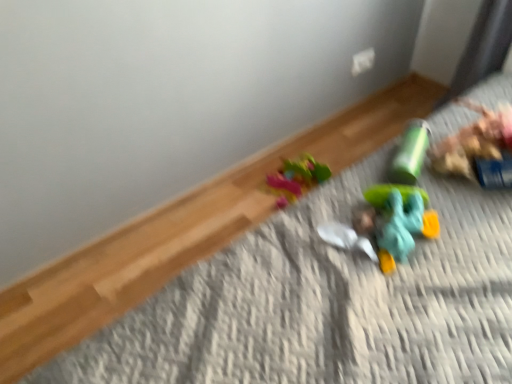
Question: Is smooth plastic head at center aimed at green matte cylinder at upper right, acting as the second toy starting from the front?

Choices:
 (A) no
 (B) yes

Answer: (A)

Question: Considering the relative sizes of smooth plastic head at center and green matte cylinder at upper right, marked as the 2th toy in a bottom-to-top arrangement, in the image provided, is smooth plastic head at center thinner than green matte cylinder at upper right, marked as the 2th toy in a bottom-to-top arrangement,?

Choices:
 (A) no
 (B) yes

Answer: (B)

Question: From the image's perspective, is smooth plastic head at center over green matte cylinder at upper right, positioned as the 1th toy in top-to-bottom order?

Choices:
 (A) no
 (B) yes

Answer: (A)

Question: Is smooth plastic head at center not within green matte cylinder at upper right, positioned as the 1th toy in top-to-bottom order?

Choices:
 (A) yes
 (B) no

Answer: (A)

Question: Is smooth plastic head at center facing away from green matte cylinder at upper right, positioned as the 1th toy in top-to-bottom order?

Choices:
 (A) yes
 (B) no

Answer: (B)

Question: Can you confirm if smooth plastic head at center is taller than green matte cylinder at upper right, which is counted as the first toy, starting from the back?

Choices:
 (A) yes
 (B) no

Answer: (B)

Question: From the image's perspective, is green matte cylinder at upper right, acting as the second toy starting from the front, located above translucent teal toy at lower right, which is the 2th toy from top to bottom?

Choices:
 (A) yes
 (B) no

Answer: (A)

Question: Does green matte cylinder at upper right, acting as the second toy starting from the front, have a lesser height compared to translucent teal toy at lower right, which is the 2th toy from top to bottom?

Choices:
 (A) yes
 (B) no

Answer: (B)

Question: Does green matte cylinder at upper right, marked as the 2th toy in a bottom-to-top arrangement, touch translucent teal toy at lower right, the 1th toy when ordered from bottom to top?

Choices:
 (A) no
 (B) yes

Answer: (A)

Question: From the image's perspective, would you say green matte cylinder at upper right, acting as the second toy starting from the front, is shown under translucent teal toy at lower right, the 1th toy when ordered from bottom to top?

Choices:
 (A) no
 (B) yes

Answer: (A)

Question: From a real-world perspective, is green matte cylinder at upper right, marked as the 2th toy in a bottom-to-top arrangement, located higher than translucent teal toy at lower right, which is the 2th toy from top to bottom?

Choices:
 (A) yes
 (B) no

Answer: (A)

Question: Could translucent teal toy at lower right, which ranks as the 2th toy in back-to-front order, be considered to be inside green matte cylinder at upper right, positioned as the 1th toy in top-to-bottom order?

Choices:
 (A) no
 (B) yes

Answer: (A)

Question: Does smooth plastic head at center appear on the left side of translucent teal toy at lower right, which is the 2th toy from top to bottom?

Choices:
 (A) yes
 (B) no

Answer: (A)